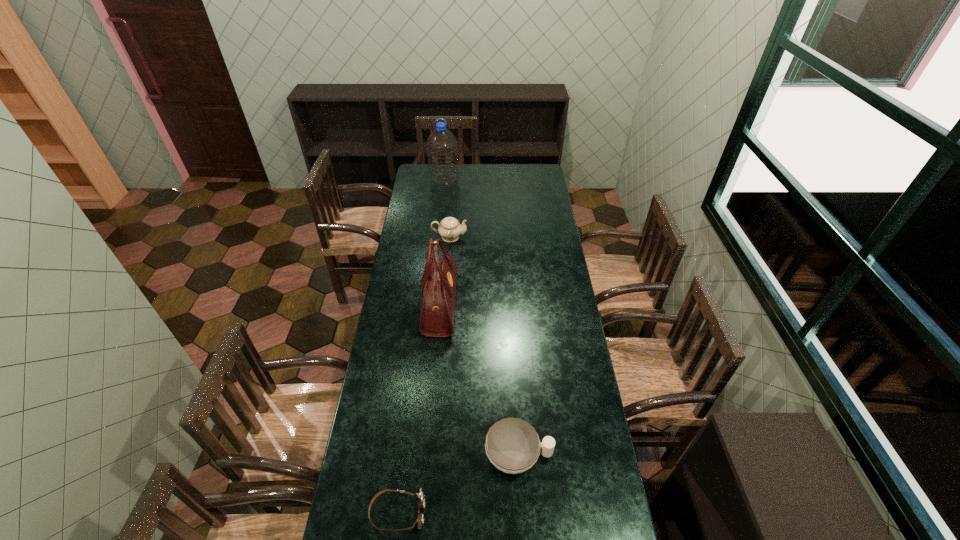
This screenshot has height=540, width=960. Find the location of `free region at the right edge of the desktop`. free region at the right edge of the desktop is located at coordinates (543, 231).

Identify the location of vacant area that lies between the nearest object and the shorter chinaware. (458, 484).

Locate an element on the screen. The image size is (960, 540). free spot between the right chinaware and the third farthest object is located at coordinates (479, 380).

Image resolution: width=960 pixels, height=540 pixels. In order to click on free spot between the farther chinaware and the nearer chinaware in this screenshot , I will do `click(484, 347)`.

Locate an element on the screen. This screenshot has width=960, height=540. free area in between the farthest object and the goggles is located at coordinates (420, 347).

Image resolution: width=960 pixels, height=540 pixels. I want to click on vacant point located between the nearer chinaware and the nearest object, so click(x=458, y=484).

The image size is (960, 540). Identify the location of free point between the water jug and the goggles. (420, 347).

At what (x,y) coordinates should I click in order to perform the action: click on unoccupied area between the handbag and the right chinaware. Please return your answer as a coordinate pair (x, y). Image resolution: width=960 pixels, height=540 pixels. Looking at the image, I should click on (479, 380).

The height and width of the screenshot is (540, 960). What are the coordinates of `object that can be found as the second closest to the left chinaware` in the screenshot? It's located at (442, 146).

Locate which object is the third closest to the goggles. Please provide its 2D coordinates. Your answer should be formatted as a tuple, i.e. [(x, y)], where the tuple contains the x and y coordinates of a point satisfying the conditions above.

[(450, 229)]